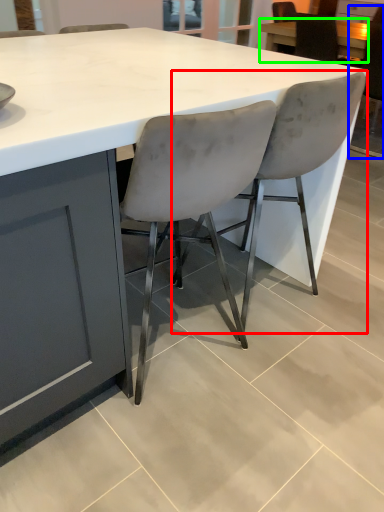
Question: Which object is the closest to the chair (highlighted by a red box)? Choose among these: chair (highlighted by a blue box) or table (highlighted by a green box).

Choices:
 (A) chair
 (B) table

Answer: (A)